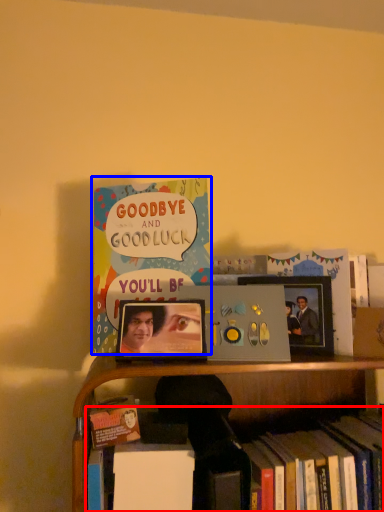
Question: Which point is closer to the camera, book (highlighted by a red box) or book (highlighted by a blue box)?

Choices:
 (A) book
 (B) book

Answer: (A)